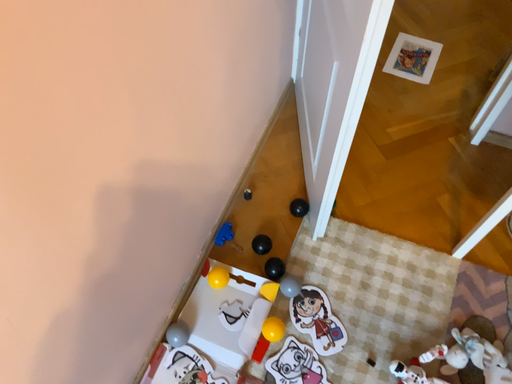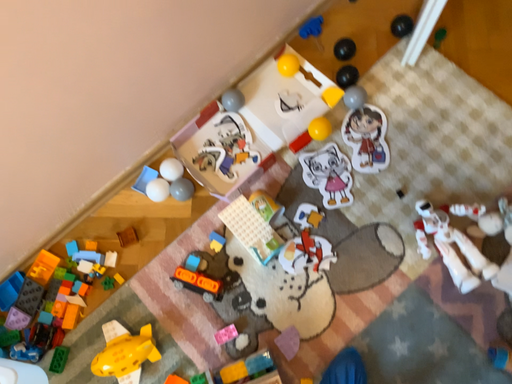
Question: How did the camera likely rotate when shooting the video?

Choices:
 (A) rotated downward
 (B) rotated upward

Answer: (A)